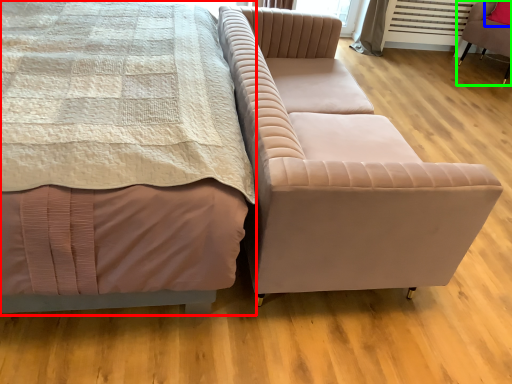
Question: Which object is positioned closest to bed (highlighted by a red box)? Select from pillow (highlighted by a blue box) and chair (highlighted by a green box).

Choices:
 (A) pillow
 (B) chair

Answer: (B)